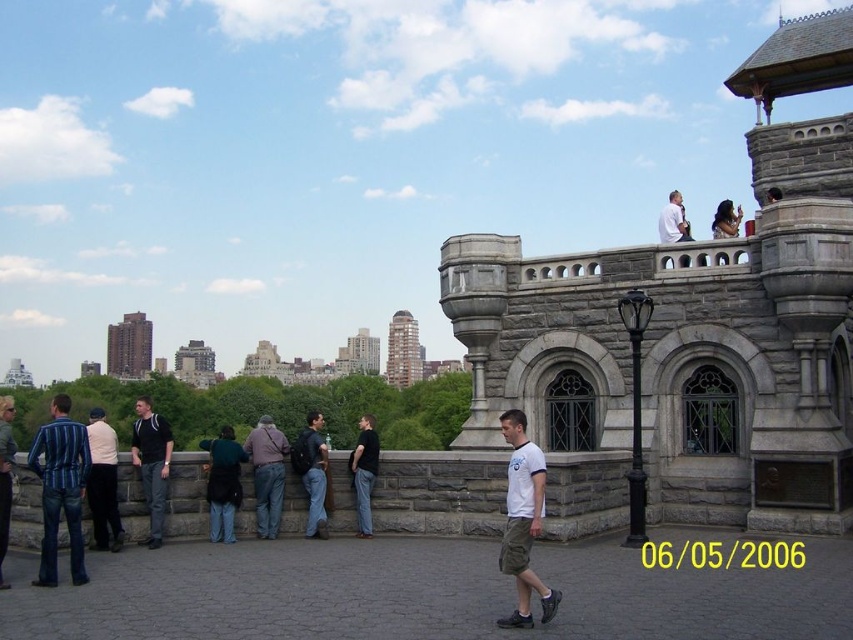
Who is positioned more to the left, gray stone fort at upper right or white shirt at upper right?

white shirt at upper right is more to the left.

This screenshot has width=853, height=640. In order to click on gray stone fort at upper right in this screenshot , I will do `click(695, 324)`.

Can you confirm if light brown leather jacket at left is taller than dark gray backpack at center?

Incorrect, light brown leather jacket at left's height is not larger of dark gray backpack at center's.

Image resolution: width=853 pixels, height=640 pixels. What do you see at coordinates (103, 483) in the screenshot?
I see `light brown leather jacket at left` at bounding box center [103, 483].

Where is `light brown leather jacket at left`? light brown leather jacket at left is located at coordinates (103, 483).

Measure the distance from dark gray jeans at center to dark gray backpack at center.

dark gray jeans at center and dark gray backpack at center are 53.47 feet apart.

Is point (148, 429) positioned in front of point (363, 476)?

Yes, point (148, 429) is closer to viewer.

Where is `dark gray jeans at center`? The width and height of the screenshot is (853, 640). dark gray jeans at center is located at coordinates (151, 464).